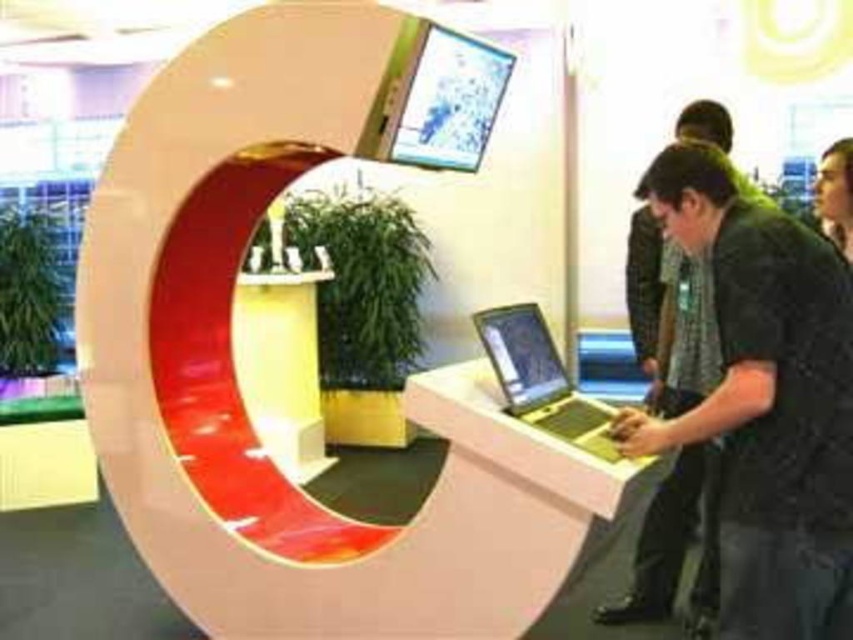
Question: From the image, what is the correct spatial relationship of white plastic information desk at center in relation to black glossy hair at upper right?

Choices:
 (A) right
 (B) left

Answer: (B)

Question: Which point is closer to the camera?

Choices:
 (A) (834, 179)
 (B) (241, 342)
 (C) (553, 387)

Answer: (C)

Question: Among these objects, which one is nearest to the camera?

Choices:
 (A) white plastic information desk at center
 (B) yellow matte/soft plastic at center
 (C) silver metallic laptop at center

Answer: (A)

Question: Estimate the real-world distances between objects in this image. Which object is farther from the white plastic information desk at center?

Choices:
 (A) silver metallic laptop at center
 (B) yellow matte/soft plastic at center
 (C) black textured shirt at center

Answer: (B)

Question: Is black textured shirt at center smaller than yellow matte/soft plastic at center?

Choices:
 (A) yes
 (B) no

Answer: (B)

Question: Is yellow matte/soft plastic at center above black glossy hair at upper right?

Choices:
 (A) yes
 (B) no

Answer: (B)